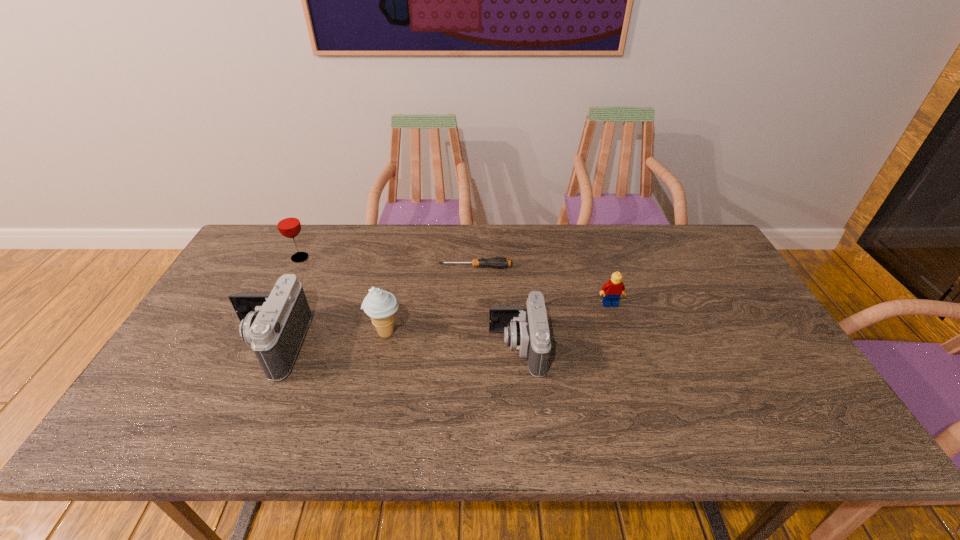
Where is `the taller camera`? Image resolution: width=960 pixels, height=540 pixels. the taller camera is located at coordinates (274, 324).

Locate an element on the screen. the shorter camera is located at coordinates (527, 330).

Locate an element on the screen. glass is located at coordinates (288, 223).

What are the coordinates of `screwdriver` in the screenshot? It's located at (496, 262).

I want to click on icecream, so click(x=380, y=305).

What are the coordinates of `Lego` in the screenshot? It's located at (614, 288).

I want to click on the third farthest object, so pyautogui.click(x=614, y=288).

Image resolution: width=960 pixels, height=540 pixels. In order to click on free location located 0.140m at the front of the left camera with an open lens cover in this screenshot , I will do `click(181, 345)`.

This screenshot has height=540, width=960. What are the coordinates of `vacant area located 0.080m at the front of the right camera with an open lens cover` in the screenshot? It's located at (459, 348).

Where is `free space located at the front of the right camera with an open lens cover`? free space located at the front of the right camera with an open lens cover is located at coordinates (359, 348).